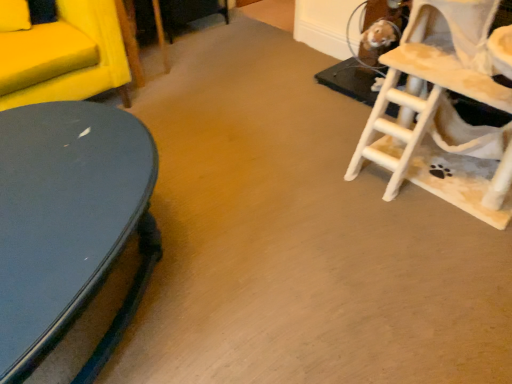
Question: From a real-world perspective, is white wooden ladder at right positioned above or below glossy dark blue table at left?

Choices:
 (A) above
 (B) below

Answer: (A)

Question: Based on their sizes in the image, would you say white wooden ladder at right is bigger or smaller than glossy dark blue table at left?

Choices:
 (A) big
 (B) small

Answer: (A)

Question: In the image, is white wooden ladder at right positioned in front of or behind glossy dark blue table at left?

Choices:
 (A) behind
 (B) front

Answer: (A)

Question: From the image's perspective, is glossy dark blue table at left located above or below white wooden ladder at right?

Choices:
 (A) below
 (B) above

Answer: (A)

Question: Is glossy dark blue table at left wider or thinner than white wooden ladder at right?

Choices:
 (A) wide
 (B) thin

Answer: (A)

Question: Is glossy dark blue table at left inside or outside of white wooden ladder at right?

Choices:
 (A) outside
 (B) inside

Answer: (A)

Question: From a real-world perspective, relative to white wooden ladder at right, is glossy dark blue table at left vertically above or below?

Choices:
 (A) above
 (B) below

Answer: (B)